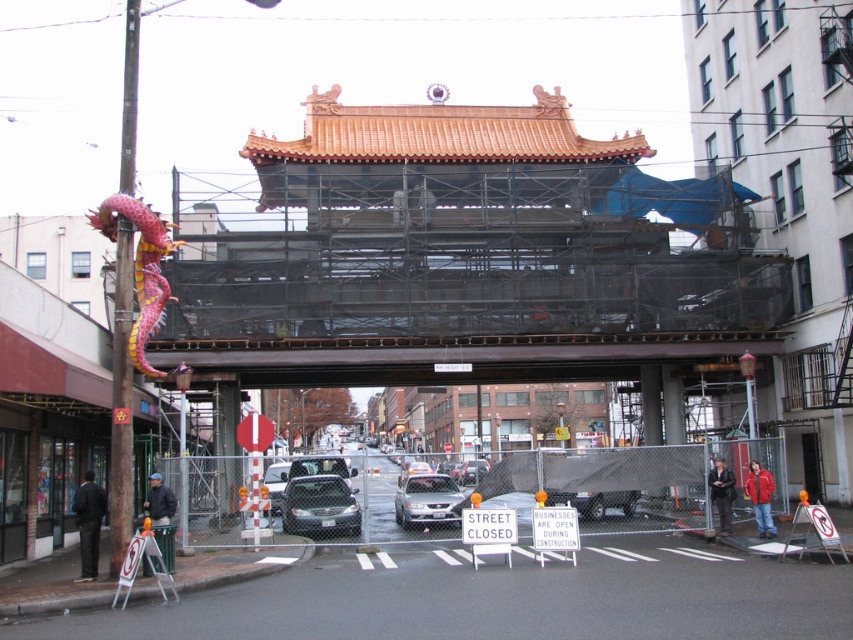
You are a delivery driver trying to park your truck in the street. You see a matte black sedan at center and a silver metallic sedan at center. Which car is blocking your path closer to you?

The matte black sedan at center is blocking your path closer to you since it is in front of the silver metallic sedan at center.

You are a delivery driver who needs to park your vehicle, which is 1.5 meters tall, in the area near the traditional Chinese gate. The parking spot is between the matte black sedan at center and the silver metallic sedan at center. Can your vehicle fit in this space without hitting the roof?

The matte black sedan at center has a lesser height compared to the silver metallic sedan at center. Since your vehicle is 1.5 meters tall, you need to check the height of the lowest point between them. If the lowest point is at least 1.5 meters, it should fit. However, without exact measurements, it is uncertain. The safest option is to avoid parking there to prevent damage.